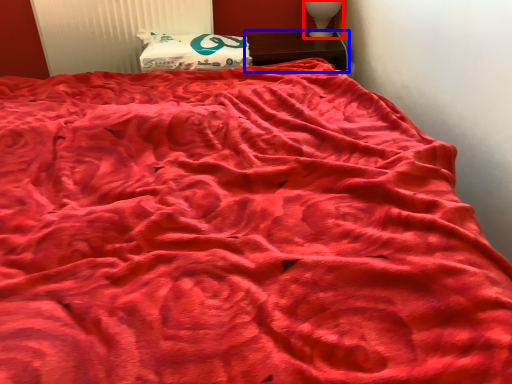
Question: Which object appears farthest to the camera in this image, table lamp (highlighted by a red box) or furniture (highlighted by a blue box)?

Choices:
 (A) table lamp
 (B) furniture

Answer: (A)